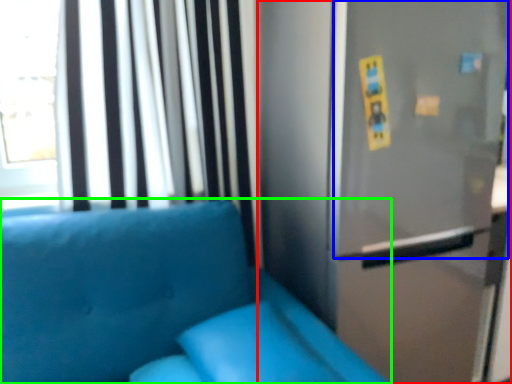
Question: Considering the real-world distances, which object is closest to fridge (highlighted by a red box)? screen door (highlighted by a blue box) or furniture (highlighted by a green box).

Choices:
 (A) screen door
 (B) furniture

Answer: (A)